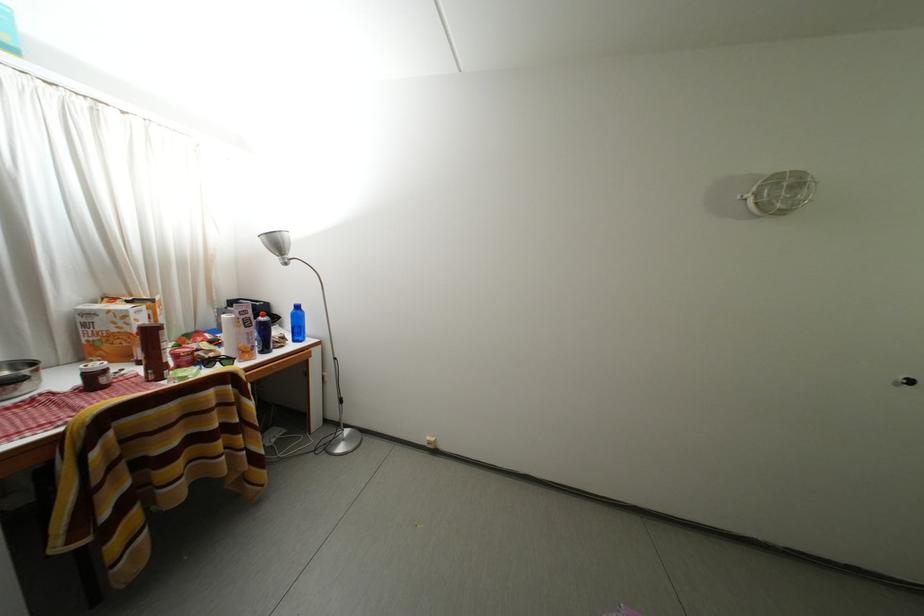
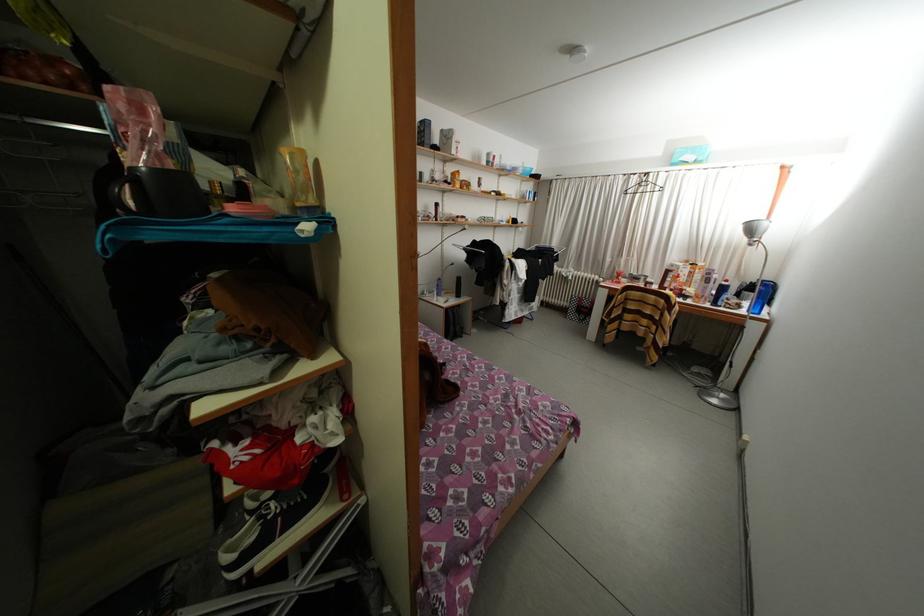
Find the pixel in the second image that matches [292,344] in the first image.

(747, 310)